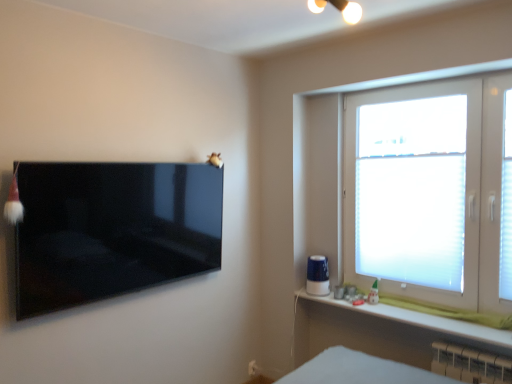
Identify the location of white plastic radiator at lower right. click(470, 364).

What do you see at coordinates (112, 230) in the screenshot?
I see `glossy black tv at left` at bounding box center [112, 230].

Locate an element on the screen. white plastic electric outlet at lower center is located at coordinates (253, 368).

Locate an element on the screen. white matte window sill at lower right is located at coordinates (421, 320).

Find the location of `white plastic radiator at lower right`. white plastic radiator at lower right is located at coordinates (x=470, y=364).

How far apart are white translucent blinds at right and white plastic electric outlet at lower center?

A distance of 1.56 meters exists between white translucent blinds at right and white plastic electric outlet at lower center.

From a real-world perspective, relative to white plastic electric outlet at lower center, is white translucent blinds at right vertically above or below?

Clearly, from a real-world perspective, white translucent blinds at right is above white plastic electric outlet at lower center.

Considering the sizes of objects white translucent blinds at right and white plastic electric outlet at lower center in the image provided, who is taller, white translucent blinds at right or white plastic electric outlet at lower center?

white translucent blinds at right is taller.

Is white translucent blinds at right bigger than white plastic electric outlet at lower center?

Correct, white translucent blinds at right is larger in size than white plastic electric outlet at lower center.

Does white plastic electric outlet at lower center touch white plastic radiator at lower right?

There is a gap between white plastic electric outlet at lower center and white plastic radiator at lower right.

From a real-world perspective, which is physically above, white plastic electric outlet at lower center or white plastic radiator at lower right?

white plastic radiator at lower right, from a real-world perspective.

Considering the relative sizes of white plastic electric outlet at lower center and white plastic radiator at lower right in the image provided, is white plastic electric outlet at lower center smaller than white plastic radiator at lower right?

Yes, white plastic electric outlet at lower center is smaller than white plastic radiator at lower right.

Which object is closer to the camera, white plastic electric outlet at lower center or white plastic radiator at lower right?

white plastic radiator at lower right is closer to the camera.

Does white plastic radiator at lower right have a lesser width compared to white matte window sill at lower right?

Yes, white plastic radiator at lower right is thinner than white matte window sill at lower right.

Which is in front, point (476, 366) or point (442, 320)?

Positioned in front is point (476, 366).

In the image, is white plastic radiator at lower right positioned in front of or behind white matte window sill at lower right?

In the image, white plastic radiator at lower right appears behind white matte window sill at lower right.

Does white plastic radiator at lower right have a greater height compared to white matte window sill at lower right?

Yes.

Between white frosted glass window at right and white matte window sill at lower right, which one has smaller width?

white frosted glass window at right is thinner.

From the image's perspective, who appears lower, white frosted glass window at right or white matte window sill at lower right?

white matte window sill at lower right is shown below in the image.

Can you confirm if white frosted glass window at right is positioned to the right of white matte window sill at lower right?

Indeed, white frosted glass window at right is positioned on the right side of white matte window sill at lower right.

Which of these two, white frosted glass window at right or white matte window sill at lower right, is smaller?

With smaller size is white matte window sill at lower right.

From the image's perspective, who appears lower, white frosted glass window at right or white plastic electric outlet at lower center?

white plastic electric outlet at lower center appears lower in the image.

Looking at this image, is white frosted glass window at right positioned with its back to white plastic electric outlet at lower center?

No, white frosted glass window at right is not facing away from white plastic electric outlet at lower center.

Find the location of a particular element. This screenshot has height=384, width=512. electric outlet that appears below the white frosted glass window at right (from the image's perspective) is located at coordinates (253, 368).

Can you tell me how much white frosted glass window at right and white plastic electric outlet at lower center differ in facing direction?

The facing directions of white frosted glass window at right and white plastic electric outlet at lower center are 91.5 degrees apart.

From the image's perspective, is glossy black tv at left over white translucent blinds at right?

No, from the image's perspective, glossy black tv at left is not over white translucent blinds at right.

Considering the positions of objects glossy black tv at left and white translucent blinds at right in the image provided, who is more to the right, glossy black tv at left or white translucent blinds at right?

white translucent blinds at right.

Can we say glossy black tv at left lies outside white translucent blinds at right?

Yes, glossy black tv at left is outside of white translucent blinds at right.

Is glossy black tv at left placed right next to white translucent blinds at right?

There is a gap between glossy black tv at left and white translucent blinds at right.

Is glossy black tv at left positioned before white plastic electric outlet at lower center?

Yes, glossy black tv at left is in front of white plastic electric outlet at lower center.

Is glossy black tv at left next to white plastic electric outlet at lower center and touching it?

No, glossy black tv at left is not beside white plastic electric outlet at lower center.

Which of these two, glossy black tv at left or white plastic electric outlet at lower center, is bigger?

glossy black tv at left is bigger.

Consider the image. Is glossy black tv at left oriented towards white plastic electric outlet at lower center?

No, glossy black tv at left is not facing towards white plastic electric outlet at lower center.

Where is `window screen in front of the white plastic electric outlet at lower center`? Image resolution: width=512 pixels, height=384 pixels. window screen in front of the white plastic electric outlet at lower center is located at coordinates (411, 219).

The image size is (512, 384). I want to click on electric outlet behind the white plastic radiator at lower right, so click(253, 368).

Looking at the image, which one is located further to white plastic radiator at lower right, white matte window sill at lower right or glossy black tv at left?

glossy black tv at left.

Looking at the image, which one is located further to white matte window sill at lower right, glossy black tv at left or white translucent blinds at right?

glossy black tv at left.

Considering their positions, is white translucent blinds at right positioned closer to white plastic electric outlet at lower center than white frosted glass window at right?

The object closer to white plastic electric outlet at lower center is white translucent blinds at right.

When comparing their distances from white matte window sill at lower right, does white plastic electric outlet at lower center or white plastic radiator at lower right seem further?

Among the two, white plastic electric outlet at lower center is located further to white matte window sill at lower right.

Looking at this image, based on their spatial positions, is white plastic radiator at lower right or glossy black tv at left further from white plastic electric outlet at lower center?

Among the two, glossy black tv at left is located further to white plastic electric outlet at lower center.

Based on their spatial positions, is white matte window sill at lower right or glossy black tv at left closer to white translucent blinds at right?

white matte window sill at lower right is closer to white translucent blinds at right.

Estimate the real-world distances between objects in this image. Which object is further from white plastic radiator at lower right, white translucent blinds at right or white frosted glass window at right?

white frosted glass window at right lies further to white plastic radiator at lower right than the other object.

Estimate the real-world distances between objects in this image. Which object is further from glossy black tv at left, white matte window sill at lower right or white frosted glass window at right?

Based on the image, white frosted glass window at right appears to be further to glossy black tv at left.

You are a GUI agent. You are given a task and a screenshot of the screen. Output one action in this format:
    pyautogui.click(x=<x>, y=<y>)
    Task: Click on the electric outlet between glossy black tv at left and white translucent blinds at right in the horizontal direction
    
    Given the screenshot: What is the action you would take?
    pyautogui.click(x=253, y=368)

The image size is (512, 384). Find the location of `electric outlet located between glossy black tv at left and white plastic radiator at lower right in the left-right direction`. electric outlet located between glossy black tv at left and white plastic radiator at lower right in the left-right direction is located at coordinates (253, 368).

Find the location of a particular element. The height and width of the screenshot is (384, 512). window sill between white frosted glass window at right and white plastic electric outlet at lower center vertically is located at coordinates (421, 320).

Where is `window screen between white frosted glass window at right and white matte window sill at lower right in the vertical direction`? window screen between white frosted glass window at right and white matte window sill at lower right in the vertical direction is located at coordinates (411, 219).